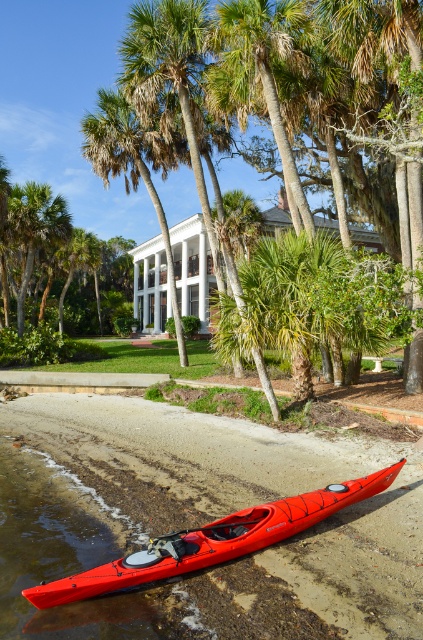
You are standing at the point marked by the coordinates (213, 540) in the coastal scene. Looking around, you see the shiny red kayak at lower left. Based on the scene description, what is the nearest object to your current position?

The nearest object to your current position at point (213, 540) is the shiny red kayak at lower left since the coordinates mark its location.

You are standing at the center of the image. Which direction should you move to reach the shiny red kayak at lower left?

Since the shiny red kayak at lower left is located at point [213,540], you should move towards the lower left direction to reach it.